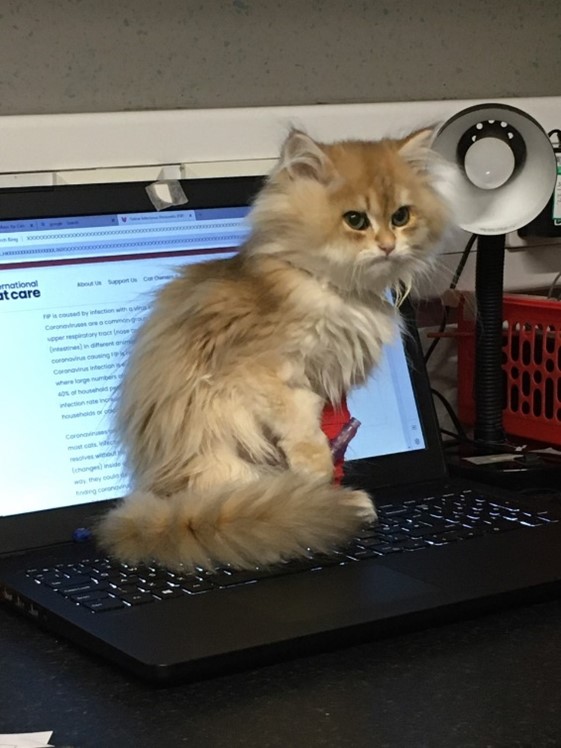
I want to click on lightbulb, so click(485, 156).